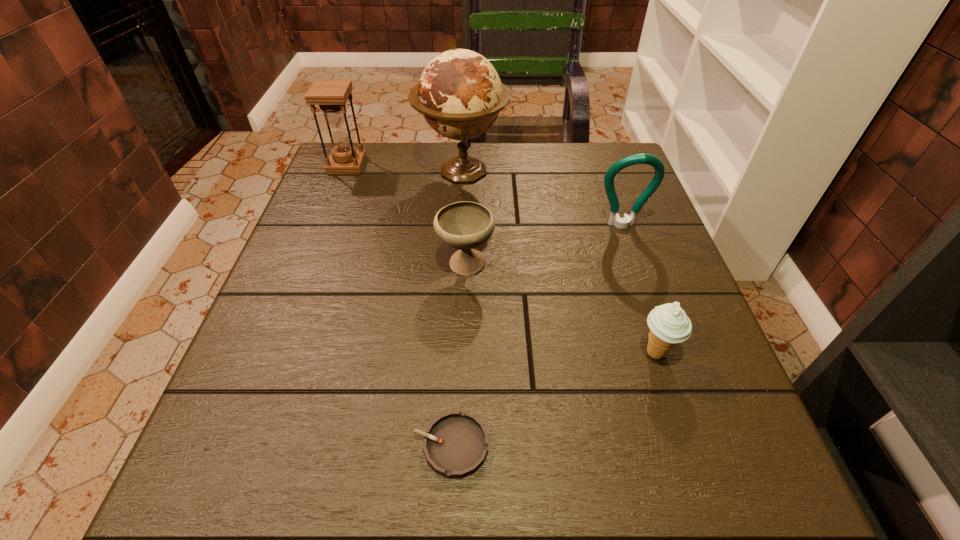
Image resolution: width=960 pixels, height=540 pixels. I want to click on globe, so click(460, 95).

Identify the location of hourglass. The width and height of the screenshot is (960, 540). (331, 95).

This screenshot has height=540, width=960. What are the coordinates of `the third farthest object` in the screenshot? It's located at (614, 219).

The image size is (960, 540). Identify the location of chalice. (465, 225).

Identify the location of the fifth farthest object. (669, 325).

Find the location of a particular element. the shortest object is located at coordinates (455, 444).

Locate an element on the screen. ashtray is located at coordinates (455, 444).

The height and width of the screenshot is (540, 960). In order to click on free space located on the front of the tallest object showing Asia in this screenshot , I will do `click(457, 277)`.

This screenshot has height=540, width=960. Find the location of `blank space located on the right of the leftmost object`. blank space located on the right of the leftmost object is located at coordinates (450, 165).

Identify the location of vacant area located 0.180m at the jaws of the third farthest object. The height and width of the screenshot is (540, 960). pyautogui.click(x=644, y=290).